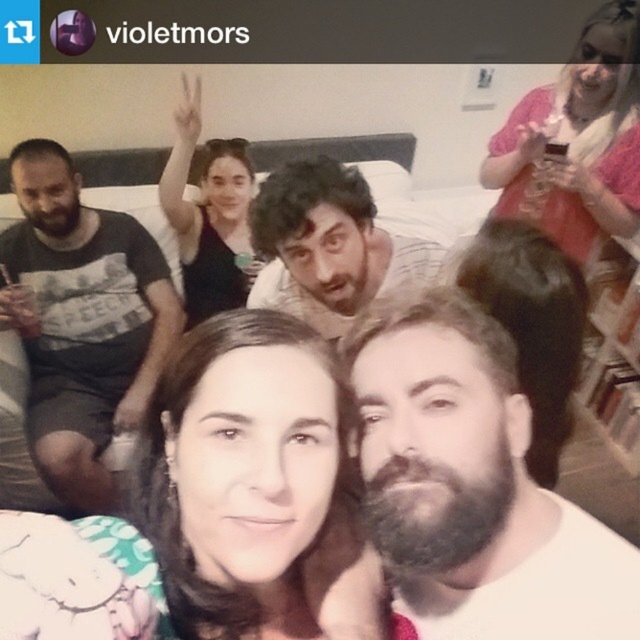
You are a photographer trying to capture a group photo. You need to ensure that the pink sheer blouse at upper right and the matte black shirt at center are both in focus. The camera you are using has a depth of field that can cover 3 feet. Can you capture both subjects in focus without adjusting your camera settings?

The distance between the pink sheer blouse at upper right and the matte black shirt at center is 3.54 feet. Since the camera can only cover 3 feet in depth of field, you cannot capture both subjects in focus without adjusting your camera settings.

You are trying to identify two people with brown hair in the image. The first person has smooth brown hair at center and the second has dark brown hair at center. Which of these two has a narrower width?

The smooth brown hair at center has a lesser width compared to dark brown hair at center.